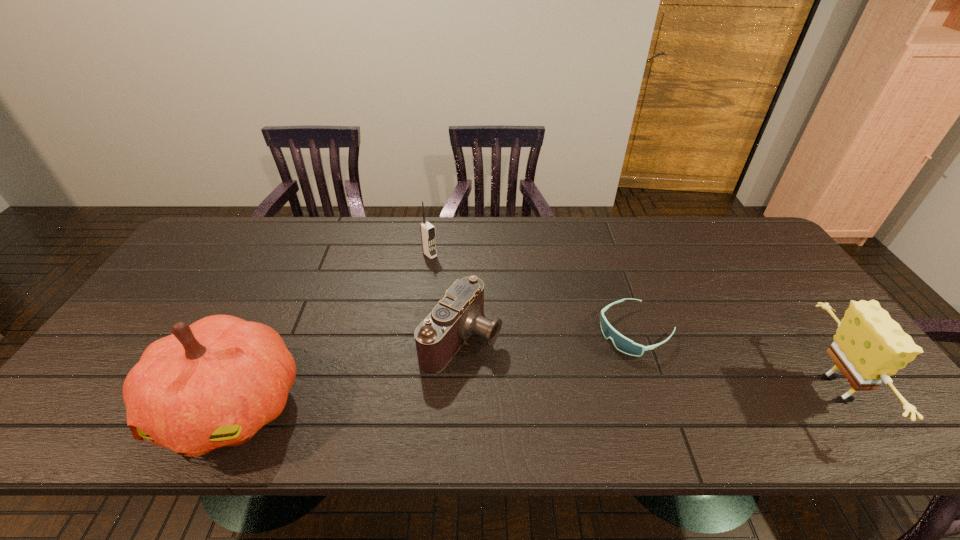
What are the coordinates of `pumpkin` in the screenshot? It's located at tap(214, 383).

You are a GUI agent. You are given a task and a screenshot of the screen. Output one action in this format:
    pyautogui.click(x=<x>, y=<y>)
    Task: Click on the tallest object
    The image size is (960, 540).
    Given the screenshot: What is the action you would take?
    (214, 383)

You are a GUI agent. You are given a task and a screenshot of the screen. Output one action in this format:
    pyautogui.click(x=<x>, y=<y>)
    Task: Click on the sponge
    
    Given the screenshot: What is the action you would take?
    pyautogui.click(x=869, y=346)

Where is `the second tallest object`? the second tallest object is located at coordinates (869, 346).

Find the location of a particular element. Image resolution: width=960 pixels, height=540 pixels. the fourth object from left to right is located at coordinates (622, 343).

You are a GUI agent. You are given a task and a screenshot of the screen. Output one action in this format:
    pyautogui.click(x=<x>, y=<y>)
    Task: Click on the shortest object
    
    Given the screenshot: What is the action you would take?
    pyautogui.click(x=622, y=343)

You are a GUI agent. You are given a task and a screenshot of the screen. Output one action in this format:
    pyautogui.click(x=<x>, y=<y>)
    Task: Click on the camera
    This screenshot has height=540, width=960.
    Given the screenshot: What is the action you would take?
    pyautogui.click(x=460, y=314)

The image size is (960, 540). I want to click on the third shortest object, so click(x=427, y=230).

Where is `the farthest object`? The height and width of the screenshot is (540, 960). the farthest object is located at coordinates (427, 230).

You are a GUI agent. You are given a task and a screenshot of the screen. Output one action in this format:
    pyautogui.click(x=<x>, y=<y>)
    Task: Click on the vacant space located 0.290m on the front-facing side of the goggles
    
    Given the screenshot: What is the action you would take?
    pyautogui.click(x=516, y=399)